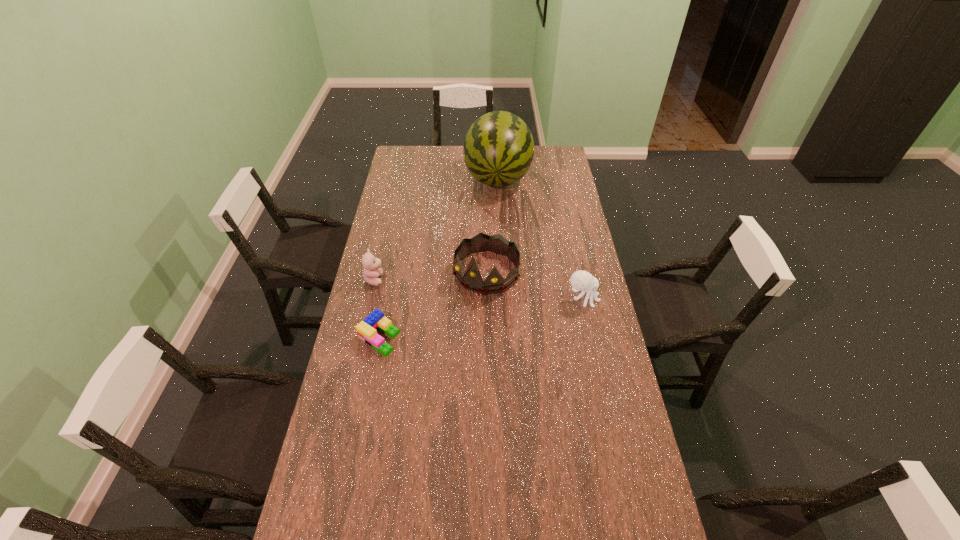
I want to click on object that is positioned at the right edge, so click(x=583, y=281).

The height and width of the screenshot is (540, 960). I want to click on vacant space at the left edge of the desktop, so click(348, 368).

In the image, there is a desktop. Find the location of `free space at the right edge`. free space at the right edge is located at coordinates (564, 326).

In the image, there is a desktop. Where is `vacant space at the far left corner`? This screenshot has width=960, height=540. vacant space at the far left corner is located at coordinates (415, 147).

This screenshot has height=540, width=960. Identify the location of vacant space at the far right corner of the desktop. (558, 153).

In order to click on free space that is in between the farthest object and the teddy bear in this screenshot , I will do `click(436, 229)`.

Where is `vacant area between the shortest object and the octopus`? Image resolution: width=960 pixels, height=540 pixels. vacant area between the shortest object and the octopus is located at coordinates (481, 318).

This screenshot has height=540, width=960. I want to click on unoccupied area between the tiara and the shortest object, so click(433, 305).

This screenshot has width=960, height=540. In order to click on unoccupied position between the shortest object and the second tallest object in this screenshot , I will do `click(433, 305)`.

Identify the location of vacant space in between the shortest object and the octopus. (481, 318).